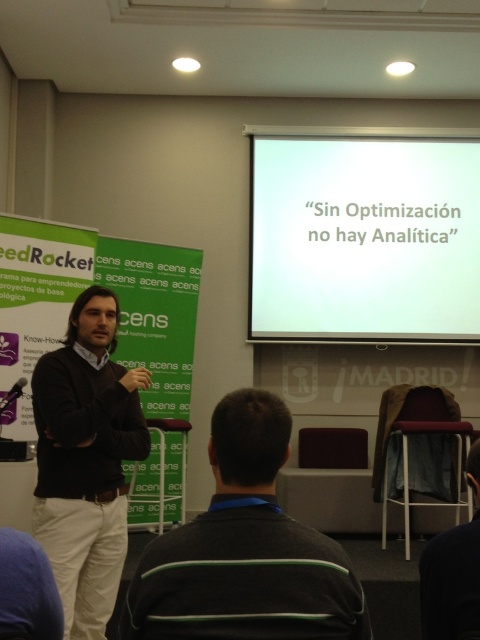
From the picture: Is white matte projection screen at upper center positioned at the back of dark blue fabric at lower right?

That is True.

Which is behind, point (434, 317) or point (432, 538)?

The point (434, 317) is behind.

Between point (342, 268) and point (444, 595), which one is positioned in front?

Point (444, 595) is more forward.

Identify the location of white matte projection screen at upper center. This screenshot has width=480, height=640. (363, 234).

Which of these two, black sweater at center or dark blue fabric at lower right, stands taller?

dark blue fabric at lower right

Is black sweater at center above dark blue fabric at lower right?

Indeed, black sweater at center is positioned over dark blue fabric at lower right.

Does point (187, 621) lie in front of point (477, 525)?

That is True.

At what (x,y) coordinates should I click in order to perform the action: click on black sweater at center. Please return your answer as a coordinate pair (x, y). Image resolution: width=480 pixels, height=640 pixels. Looking at the image, I should click on (244, 550).

Is black sweater at center above dark brown sweater at center?

Indeed, black sweater at center is positioned over dark brown sweater at center.

Find the location of a particular element. This screenshot has width=480, height=640. black sweater at center is located at coordinates (244, 550).